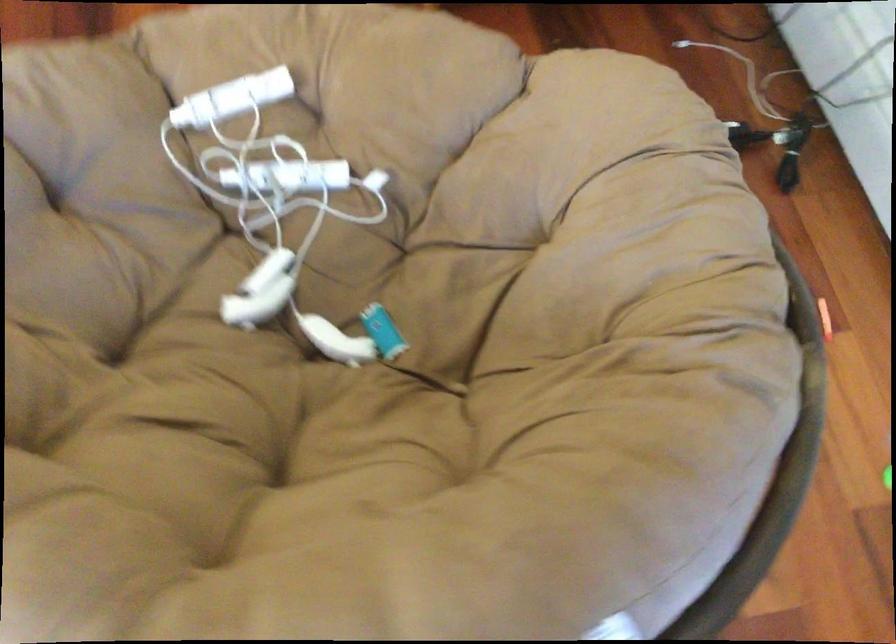
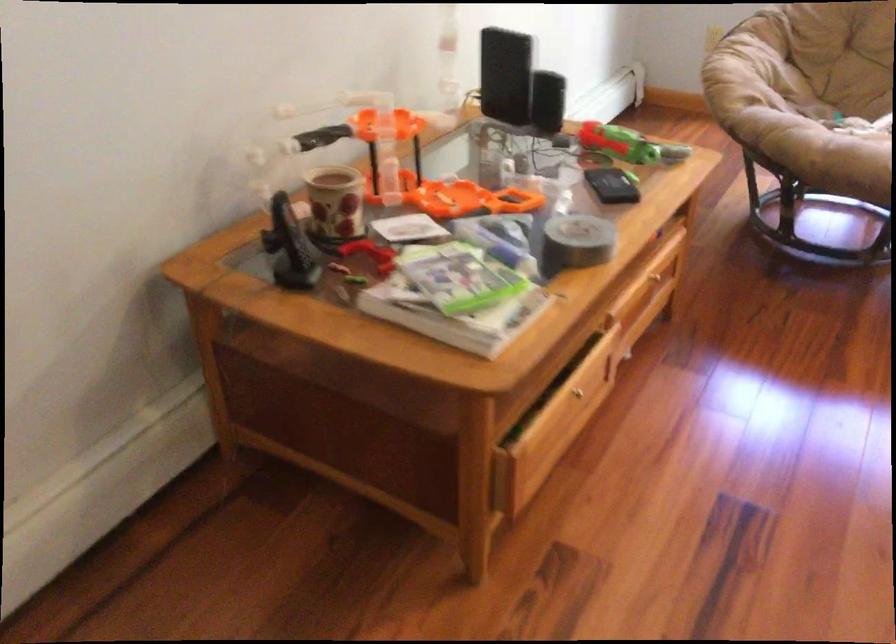
Find the pixel in the second image that matches (x=341, y=371) in the first image.

(842, 118)